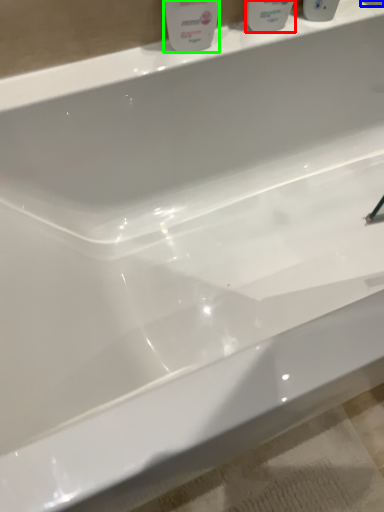
Question: Which object is the closest to the mouthwash (highlighted by a red box)? Choose among these: mouthwash (highlighted by a blue box) or cleaning product (highlighted by a green box).

Choices:
 (A) mouthwash
 (B) cleaning product

Answer: (B)